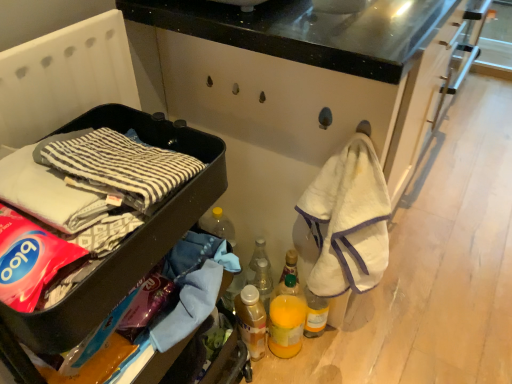
Question: In terms of size, does translucent plastic bottle at lower center, the first bottle ordered from the bottom, appear bigger or smaller than black plastic container at left?

Choices:
 (A) big
 (B) small

Answer: (B)

Question: From the image's perspective, relative to black plastic container at left, is translucent plastic bottle at lower center, the first bottle ordered from the bottom, above or below?

Choices:
 (A) above
 (B) below

Answer: (B)

Question: Estimate the real-world distances between objects in this image. Which object is farther from the black plastic container at left?

Choices:
 (A) translucent plastic bottle at lower center, the first bottle ordered from the bottom
 (B) translucent plastic bottle at center, arranged as the 1th bottle when viewed from the top

Answer: (B)

Question: Which object is the farthest from the translucent plastic bottle at center, arranged as the 1th bottle when viewed from the top?

Choices:
 (A) translucent plastic bottle at lower center, the second bottle positioned from the top
 (B) black plastic container at left

Answer: (B)